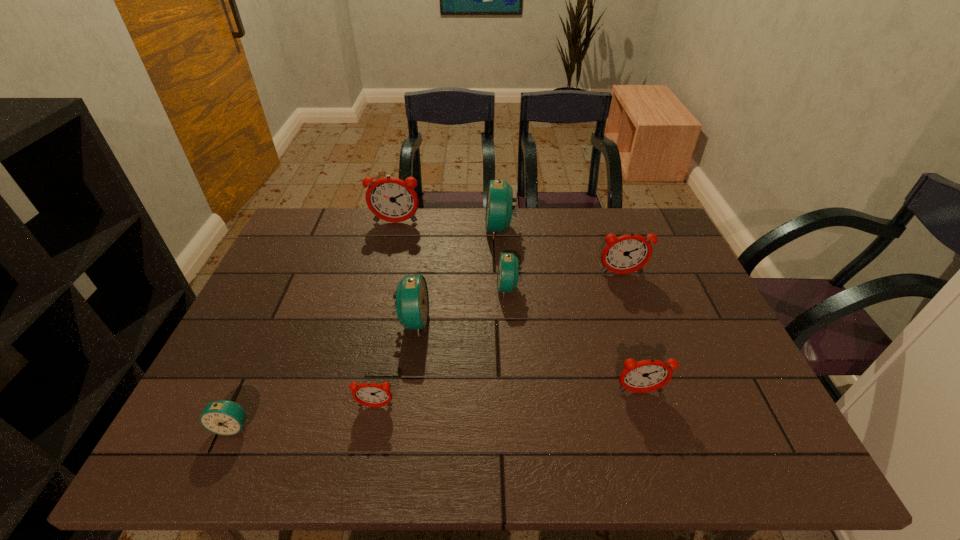
What are the coordinates of `free point between the fourth nearest object and the biggest blue alarm clock` in the screenshot? It's located at (457, 275).

Identify the location of free space that is in between the second nearest alarm clock and the biggest blue alarm clock. The image size is (960, 540). [438, 318].

Locate an element on the screen. The width and height of the screenshot is (960, 540). object that is the sixth closest to the third biggest blue alarm clock is located at coordinates (368, 394).

I want to click on the fourth closest object to the sixth farthest alarm clock, so click(x=368, y=394).

The image size is (960, 540). In order to click on the fifth closest alarm clock relative to the third biggest blue alarm clock in this screenshot , I will do `click(391, 199)`.

Select which alarm clock is the fifth closest to the third smallest blue alarm clock. Please provide its 2D coordinates. Your answer should be formatted as a tuple, i.e. [(x, y)], where the tuple contains the x and y coordinates of a point satisfying the conditions above.

[(391, 199)]

Find the location of a particular element. The width and height of the screenshot is (960, 540). blue alarm clock that is the nearest to the second nearest object is located at coordinates (412, 301).

This screenshot has width=960, height=540. I want to click on blue alarm clock identified as the fourth closest to the biggest reddish-pink alarm clock, so click(223, 417).

In order to click on reddish-pink alarm clock that can be found as the fourth closest to the farthest blue alarm clock in this screenshot , I will do `click(368, 394)`.

Locate which reddish-pink alarm clock is the closest to the third nearest reddish-pink alarm clock. Please provide its 2D coordinates. Your answer should be formatted as a tuple, i.e. [(x, y)], where the tuple contains the x and y coordinates of a point satisfying the conditions above.

[(643, 376)]